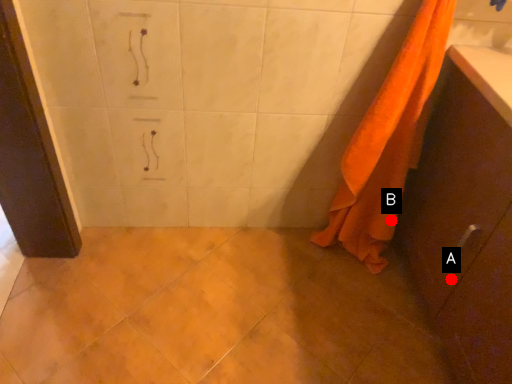
Question: Two points are circled on the image, labeled by A and B beside each circle. Which point is further to the camera?

Choices:
 (A) A is further
 (B) B is further

Answer: (B)